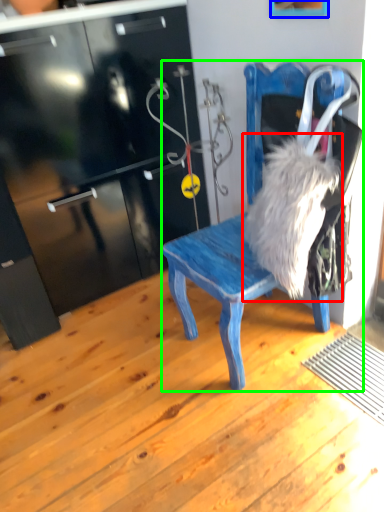
Question: Which object is the farthest from animal (highlighted by a red box)? Choose among these: picture frame (highlighted by a blue box) or chair (highlighted by a green box).

Choices:
 (A) picture frame
 (B) chair

Answer: (A)